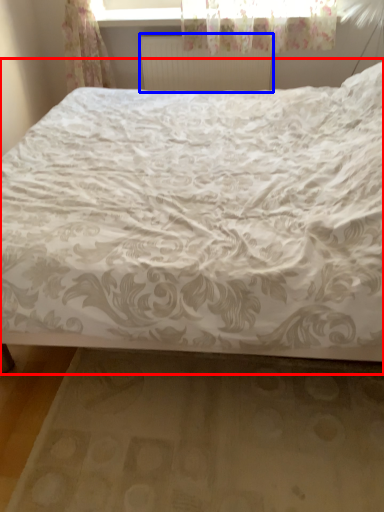
Question: Which object appears farthest to the camera in this image, bed (highlighted by a red box) or radiator (highlighted by a blue box)?

Choices:
 (A) bed
 (B) radiator

Answer: (B)